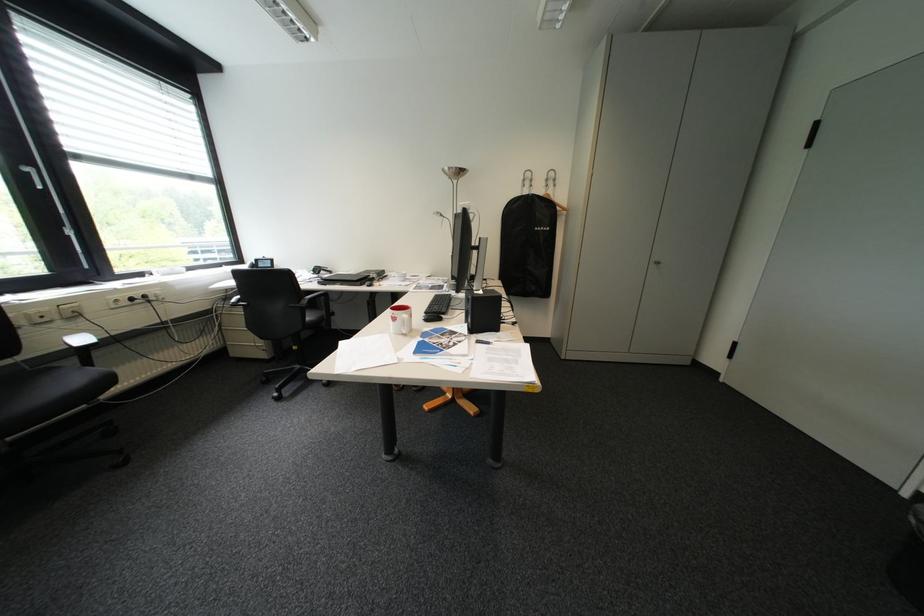
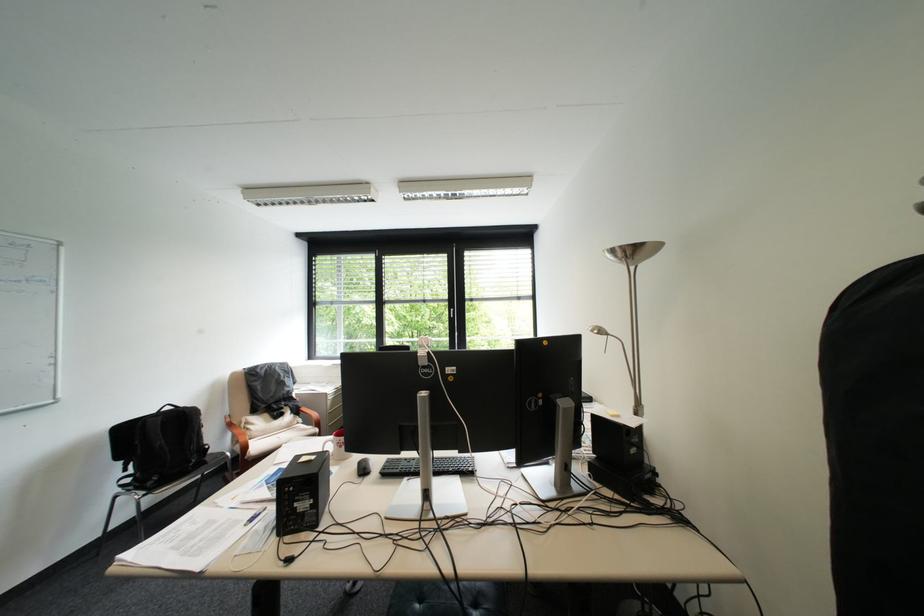
Where in the second image is the point corresponding to the point at 462,169 from the first image?

(625, 252)